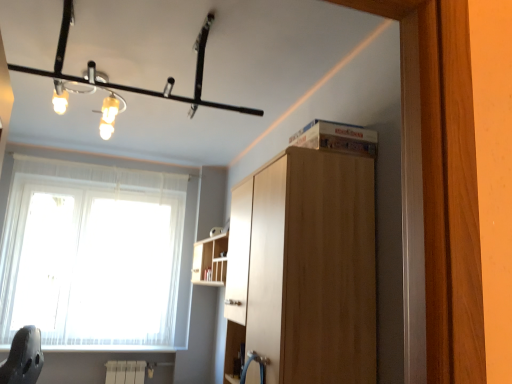
What do you see at coordinates (306, 266) in the screenshot?
I see `light brown wood cabinet at upper center` at bounding box center [306, 266].

Where is `matte black light fixture at upper center`? This screenshot has width=512, height=384. matte black light fixture at upper center is located at coordinates (77, 87).

Is matte black light fixture at upper center wider than light brown wood cabinet at upper center?

Incorrect, the width of matte black light fixture at upper center does not surpass that of light brown wood cabinet at upper center.

In the scene shown: Is the depth of matte black light fixture at upper center less than that of light brown wood cabinet at upper center?

No.

Locate an element on the screen. light fixture behind the light brown wood cabinet at upper center is located at coordinates (77, 87).

I want to click on window below the matte black light fixture at upper center (from the image's perspective), so click(92, 254).

Which is more to the right, matte black light fixture at upper center or white sheer curtain at left?

matte black light fixture at upper center is more to the right.

In the scene shown: From the image's perspective, which one is positioned lower, matte black light fixture at upper center or white sheer curtain at left?

white sheer curtain at left is shown below in the image.

What's the angular difference between matte black light fixture at upper center and white sheer curtain at left's facing directions?

The angular difference between matte black light fixture at upper center and white sheer curtain at left is 2.07 degrees.

Could wooden shelf at upper center be considered to be inside light brown wood cabinet at upper center?

No, light brown wood cabinet at upper center does not contain wooden shelf at upper center.

Could you tell me if light brown wood cabinet at upper center is turned towards wooden shelf at upper center?

No, light brown wood cabinet at upper center is not oriented towards wooden shelf at upper center.

Image resolution: width=512 pixels, height=384 pixels. Find the location of `cabinetry in front of the wooden shelf at upper center`. cabinetry in front of the wooden shelf at upper center is located at coordinates (306, 266).

From the image's perspective, relative to wooden shelf at upper center, is light brown wood cabinet at upper center above or below?

light brown wood cabinet at upper center is above wooden shelf at upper center.

Which object is wider, light brown wood cabinet at upper center or matte black light fixture at upper center?

light brown wood cabinet at upper center.

At what (x,y) coordinates should I click in order to perform the action: click on light fixture located above the light brown wood cabinet at upper center (from the image's perspective). Please return your answer as a coordinate pair (x, y). The image size is (512, 384). Looking at the image, I should click on (77, 87).

Is light brown wood cabinet at upper center oriented away from matte black light fixture at upper center?

That's not correct — light brown wood cabinet at upper center is not looking away from matte black light fixture at upper center.

From the image's perspective, is light brown wood cabinet at upper center under matte black light fixture at upper center?

Yes.

Find the location of a particular element. The width and height of the screenshot is (512, 384). light fixture in front of the white sheer curtain at left is located at coordinates click(77, 87).

Are white sheer curtain at left and matte black light fixture at upper center far apart?

Yes, white sheer curtain at left is far from matte black light fixture at upper center.

In terms of width, does white sheer curtain at left look wider or thinner when compared to matte black light fixture at upper center?

In the image, white sheer curtain at left appears to be more narrow than matte black light fixture at upper center.

Is light brown wood cabinet at upper center spatially inside white sheer curtain at left, or outside of it?

light brown wood cabinet at upper center lies outside white sheer curtain at left.

The width and height of the screenshot is (512, 384). What are the coordinates of `window below the light brown wood cabinet at upper center (from the image's perspective)` in the screenshot? It's located at (92, 254).

Can you confirm if light brown wood cabinet at upper center is positioned to the right of white sheer curtain at left?

Yes, light brown wood cabinet at upper center is to the right of white sheer curtain at left.

Who is smaller, wooden shelf at upper center or light brown wood cabinet at upper center?

Smaller between the two is wooden shelf at upper center.

From a real-world perspective, which object rests below the other?

light brown wood cabinet at upper center is physically lower.

Where is `shelf above the light brown wood cabinet at upper center (from a real-world perspective)`? Image resolution: width=512 pixels, height=384 pixels. shelf above the light brown wood cabinet at upper center (from a real-world perspective) is located at coordinates (210, 261).

In order to click on cabinetry in front of the matte black light fixture at upper center in this screenshot , I will do `click(306, 266)`.

Find the location of a particular element. This screenshot has width=512, height=384. window lying below the matte black light fixture at upper center (from the image's perspective) is located at coordinates (x=92, y=254).

Which object lies nearer to the anchor point wooden shelf at upper center, white sheer curtain at left or light brown wood cabinet at upper center?

white sheer curtain at left lies closer to wooden shelf at upper center than the other object.

Considering their positions, is light brown wood cabinet at upper center positioned closer to matte black light fixture at upper center than white sheer curtain at left?

The object closer to matte black light fixture at upper center is white sheer curtain at left.

When comparing their distances from wooden shelf at upper center, does matte black light fixture at upper center or light brown wood cabinet at upper center seem closer?

matte black light fixture at upper center is closer to wooden shelf at upper center.

Estimate the real-world distances between objects in this image. Which object is closer to matte black light fixture at upper center, wooden shelf at upper center or white sheer curtain at left?

white sheer curtain at left is positioned closer to the anchor matte black light fixture at upper center.

Looking at the image, which one is located closer to white sheer curtain at left, wooden shelf at upper center or light brown wood cabinet at upper center?

wooden shelf at upper center is closer to white sheer curtain at left.

Considering their positions, is light brown wood cabinet at upper center positioned closer to white sheer curtain at left than wooden shelf at upper center?

wooden shelf at upper center lies closer to white sheer curtain at left than the other object.

Estimate the real-world distances between objects in this image. Which object is closer to white sheer curtain at left, wooden shelf at upper center or matte black light fixture at upper center?

Among the two, wooden shelf at upper center is located nearer to white sheer curtain at left.

Estimate the real-world distances between objects in this image. Which object is closer to white sheer curtain at left, light brown wood cabinet at upper center or matte black light fixture at upper center?

matte black light fixture at upper center.

Locate an element on the screen. light fixture between light brown wood cabinet at upper center and wooden shelf at upper center along the z-axis is located at coordinates (77, 87).

Locate an element on the screen. This screenshot has width=512, height=384. shelf between matte black light fixture at upper center and white sheer curtain at left vertically is located at coordinates (210, 261).

Locate an element on the screen. light fixture located between light brown wood cabinet at upper center and white sheer curtain at left in the depth direction is located at coordinates (77, 87).

This screenshot has width=512, height=384. What are the coordinates of `shelf between light brown wood cabinet at upper center and white sheer curtain at left in the front-back direction` in the screenshot? It's located at (210, 261).